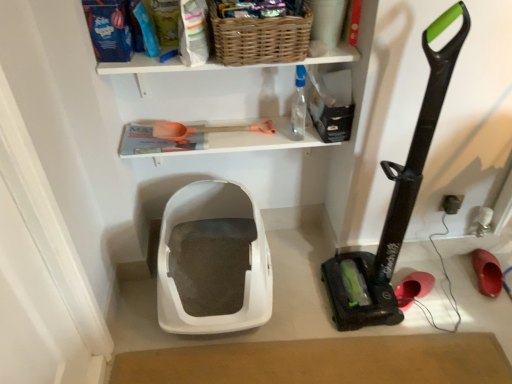
The width and height of the screenshot is (512, 384). In order to click on vacant area that lies to the right of rubberized red shoe at lower right, the first footwear from the left in this screenshot , I will do `click(451, 286)`.